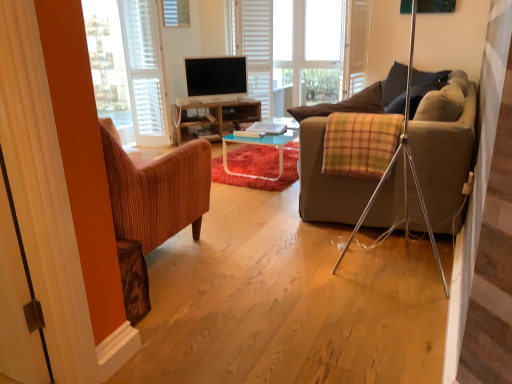
Question: Does point (135, 56) appear closer or farther from the camera than point (7, 56)?

Choices:
 (A) closer
 (B) farther

Answer: (B)

Question: Do you think white matte blinds at upper center is within white fabric curtain at left, or outside of it?

Choices:
 (A) outside
 (B) inside

Answer: (A)

Question: Which is nearer to the white wood bay window at center?

Choices:
 (A) green-yellow plaid blanket at center
 (B) dark blue fabric pillow at upper right
 (C) white glossy door at left, positioned as the 1th screen door in bottom-to-top order
 (D) white matte blinds at upper center
 (E) white wooden screen door at upper center, arranged as the second screen door when viewed from the front

Answer: (E)

Question: Which is nearer to the white wood bay window at center?

Choices:
 (A) white matte blinds at upper center
 (B) white fabric curtain at left
 (C) wooden desk at center
 (D) matte black tv at center
 (E) dark blue fabric pillow at upper right

Answer: (D)